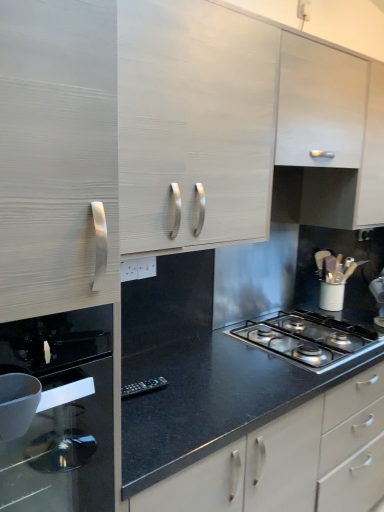
What do you see at coordinates (331, 296) in the screenshot? The height and width of the screenshot is (512, 384). I see `white matte utensil holder at right` at bounding box center [331, 296].

Identify the location of matte white cabinet at upper left, which ranks as the first cabinetry in left-to-right order. This screenshot has height=512, width=384. (194, 125).

Consider the image. Measure the distance between point (208, 33) and camera.

A distance of 1.25 meters exists between point (208, 33) and camera.

You are a GUI agent. You are given a task and a screenshot of the screen. Output one action in this format:
    pyautogui.click(x=<x>, y=<y>)
    Task: Click on the black glass oven at left
    
    Given the screenshot: What is the action you would take?
    point(62,413)

From a real-world perspective, is white wood cabinet at upper center, the second cabinetry from the left, beneath polished stainless steel gas stove at center?

No, from a real-world perspective, white wood cabinet at upper center, the second cabinetry from the left, is not under polished stainless steel gas stove at center.

In terms of height, does white wood cabinet at upper center, the second cabinetry from the left, look taller or shorter compared to polished stainless steel gas stove at center?

white wood cabinet at upper center, the second cabinetry from the left, is taller than polished stainless steel gas stove at center.

Is white wood cabinet at upper center, the second cabinetry from the left, not near polished stainless steel gas stove at center?

No, white wood cabinet at upper center, the second cabinetry from the left, is not far away from polished stainless steel gas stove at center.

Is white wood cabinet at upper center, the second cabinetry from the left, in front of or behind polished stainless steel gas stove at center in the image?

Clearly, white wood cabinet at upper center, the second cabinetry from the left, is in front of polished stainless steel gas stove at center.

From the image's perspective, between white wood cabinet at upper center, the 1th cabinetry in the right-to-left sequence, and white matte utensil holder at right, who is located below?

white matte utensil holder at right.

From a real-world perspective, which is physically above, white wood cabinet at upper center, the second cabinetry from the left, or white matte utensil holder at right?

white wood cabinet at upper center, the second cabinetry from the left.

From the picture: Could white matte utensil holder at right be considered to be inside white wood cabinet at upper center, the 1th cabinetry in the right-to-left sequence?

That's incorrect, white matte utensil holder at right is not inside white wood cabinet at upper center, the 1th cabinetry in the right-to-left sequence.

This screenshot has height=512, width=384. In the image, there is a white wood cabinet at upper center, the 1th cabinetry in the right-to-left sequence. What are the coordinates of `kitchen appliance below it (from a real-world perspective)` in the screenshot? It's located at (331, 296).

Considering the sizes of black glass oven at left and matte white cabinet at upper left, which ranks as the second cabinetry in right-to-left order, in the image, is black glass oven at left wider or thinner than matte white cabinet at upper left, which ranks as the second cabinetry in right-to-left order,?

Considering their sizes, black glass oven at left looks broader than matte white cabinet at upper left, which ranks as the second cabinetry in right-to-left order.

Identify the location of home appliance that is below the matte white cabinet at upper left, which ranks as the second cabinetry in right-to-left order (from the image's perspective). (62, 413).

From the image's perspective, relative to matte white cabinet at upper left, which ranks as the second cabinetry in right-to-left order, is black glass oven at left above or below?

black glass oven at left is below matte white cabinet at upper left, which ranks as the second cabinetry in right-to-left order.

Does black glass oven at left have a lesser height compared to matte white cabinet at upper left, which ranks as the second cabinetry in right-to-left order?

Yes.

Considering the points (332, 333) and (298, 105), which point is behind, point (332, 333) or point (298, 105)?

The point (332, 333) is farther.

From a real-world perspective, which object rests below the other?

polished stainless steel gas stove at center.

Consider the image. Between polished stainless steel gas stove at center and white wood cabinet at upper center, the second cabinetry from the left, which one appears on the left side from the viewer's perspective?

white wood cabinet at upper center, the second cabinetry from the left.

Can you confirm if polished stainless steel gas stove at center is smaller than white wood cabinet at upper center, the 1th cabinetry in the right-to-left sequence?

Yes, polished stainless steel gas stove at center is smaller than white wood cabinet at upper center, the 1th cabinetry in the right-to-left sequence.

Does matte white cabinet at upper left, which ranks as the first cabinetry in left-to-right order, turn towards white matte utensil holder at right?

No, matte white cabinet at upper left, which ranks as the first cabinetry in left-to-right order, is not oriented towards white matte utensil holder at right.

Which of these two, matte white cabinet at upper left, which ranks as the first cabinetry in left-to-right order, or white matte utensil holder at right, stands taller?

matte white cabinet at upper left, which ranks as the first cabinetry in left-to-right order, is taller.

Between point (210, 116) and point (340, 292), which one is positioned in front?

Point (210, 116)

Is matte white cabinet at upper left, which ranks as the second cabinetry in right-to-left order, completely or partially outside of white matte utensil holder at right?

Yes, matte white cabinet at upper left, which ranks as the second cabinetry in right-to-left order, is outside of white matte utensil holder at right.

From a real-world perspective, between white matte utensil holder at right and white wood cabinet at upper center, the 1th cabinetry in the right-to-left sequence, who is vertically lower?

From a 3D spatial view, white matte utensil holder at right is below.

Between white matte utensil holder at right and white wood cabinet at upper center, the second cabinetry from the left, which one has larger size?

Bigger between the two is white wood cabinet at upper center, the second cabinetry from the left.

Is white matte utensil holder at right facing away from white wood cabinet at upper center, the 1th cabinetry in the right-to-left sequence?

No, white wood cabinet at upper center, the 1th cabinetry in the right-to-left sequence, is not at the back of white matte utensil holder at right.

Between black glass oven at left and white matte utensil holder at right, which one has more height?

black glass oven at left.

Is black glass oven at left far away from white matte utensil holder at right?

That's right, there is a large distance between black glass oven at left and white matte utensil holder at right.

Is white matte utensil holder at right a part of black glass oven at left?

No, white matte utensil holder at right is not a part of black glass oven at left.

From a real-world perspective, is black glass oven at left positioned over white matte utensil holder at right based on gravity?

Yes.

Which cabinetry is the 1st one when counting from the left side of the polished stainless steel gas stove at center? Please provide its 2D coordinates.

[(320, 105)]

Which cabinetry is the 1st one when counting from the front of the white matte utensil holder at right? Please provide its 2D coordinates.

[(320, 105)]

Considering their positions, is matte white cabinet at upper left, which ranks as the second cabinetry in right-to-left order, positioned further to white matte utensil holder at right than white wood cabinet at upper center, the second cabinetry from the left?

matte white cabinet at upper left, which ranks as the second cabinetry in right-to-left order, is positioned further to the anchor white matte utensil holder at right.

Estimate the real-world distances between objects in this image. Which object is closer to white wood cabinet at upper center, the second cabinetry from the left, black glass oven at left or white matte utensil holder at right?

white matte utensil holder at right lies closer to white wood cabinet at upper center, the second cabinetry from the left, than the other object.

Estimate the real-world distances between objects in this image. Which object is further from white wood cabinet at upper center, the second cabinetry from the left, white matte utensil holder at right or matte white cabinet at upper left, which ranks as the first cabinetry in left-to-right order?

The object further to white wood cabinet at upper center, the second cabinetry from the left, is white matte utensil holder at right.

When comparing their distances from polished stainless steel gas stove at center, does black glass oven at left or white wood cabinet at upper center, the 1th cabinetry in the right-to-left sequence, seem closer?

white wood cabinet at upper center, the 1th cabinetry in the right-to-left sequence.

Looking at the image, which one is located further to matte white cabinet at upper left, which ranks as the second cabinetry in right-to-left order, polished stainless steel gas stove at center or white wood cabinet at upper center, the second cabinetry from the left?

polished stainless steel gas stove at center is positioned further to the anchor matte white cabinet at upper left, which ranks as the second cabinetry in right-to-left order.

Considering their positions, is white matte utensil holder at right positioned closer to matte white cabinet at upper left, which ranks as the second cabinetry in right-to-left order, than polished stainless steel gas stove at center?

polished stainless steel gas stove at center.

From the image, which object appears to be nearer to matte white cabinet at upper left, which ranks as the first cabinetry in left-to-right order, white matte utensil holder at right or white wood cabinet at upper center, the second cabinetry from the left?

white wood cabinet at upper center, the second cabinetry from the left, is positioned closer to the anchor matte white cabinet at upper left, which ranks as the first cabinetry in left-to-right order.

When comparing their distances from black glass oven at left, does white wood cabinet at upper center, the 1th cabinetry in the right-to-left sequence, or matte white cabinet at upper left, which ranks as the first cabinetry in left-to-right order, seem closer?

The object closer to black glass oven at left is matte white cabinet at upper left, which ranks as the first cabinetry in left-to-right order.

Where is `kitchen appliance between white wood cabinet at upper center, the 1th cabinetry in the right-to-left sequence, and polished stainless steel gas stove at center vertically`? kitchen appliance between white wood cabinet at upper center, the 1th cabinetry in the right-to-left sequence, and polished stainless steel gas stove at center vertically is located at coordinates (331, 296).

This screenshot has height=512, width=384. Identify the location of cabinetry between matte white cabinet at upper left, which ranks as the second cabinetry in right-to-left order, and white matte utensil holder at right in the front-back direction. (320, 105).

Find the location of `cabinetry between white wood cabinet at upper center, the second cabinetry from the left, and polished stainless steel gas stove at center in the up-down direction`. cabinetry between white wood cabinet at upper center, the second cabinetry from the left, and polished stainless steel gas stove at center in the up-down direction is located at coordinates [x=194, y=125].

This screenshot has height=512, width=384. I want to click on gas stove between white wood cabinet at upper center, the 1th cabinetry in the right-to-left sequence, and black glass oven at left in the up-down direction, so point(310,338).